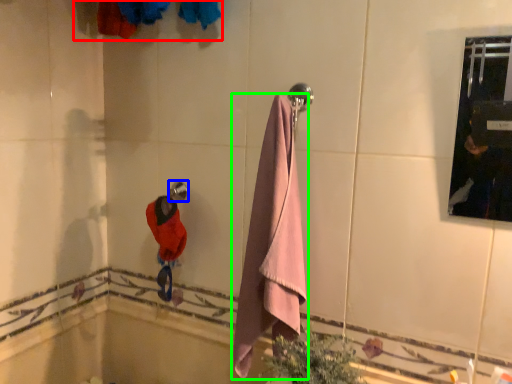
Question: Which object is the closest to the laundry (highlighted by a red box)? Choose among these: towel bar (highlighted by a blue box) or towel (highlighted by a green box).

Choices:
 (A) towel bar
 (B) towel

Answer: (A)